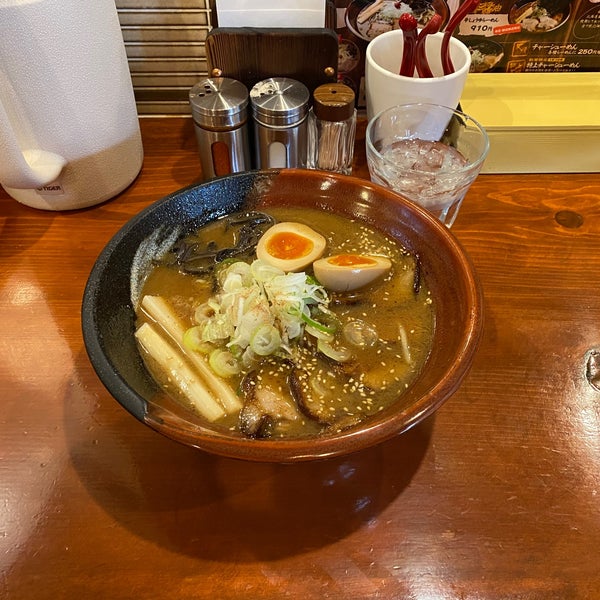
This screenshot has height=600, width=600. In order to click on restaurant menu in this screenshot , I will do `click(364, 17)`, `click(501, 30)`, `click(570, 35)`.